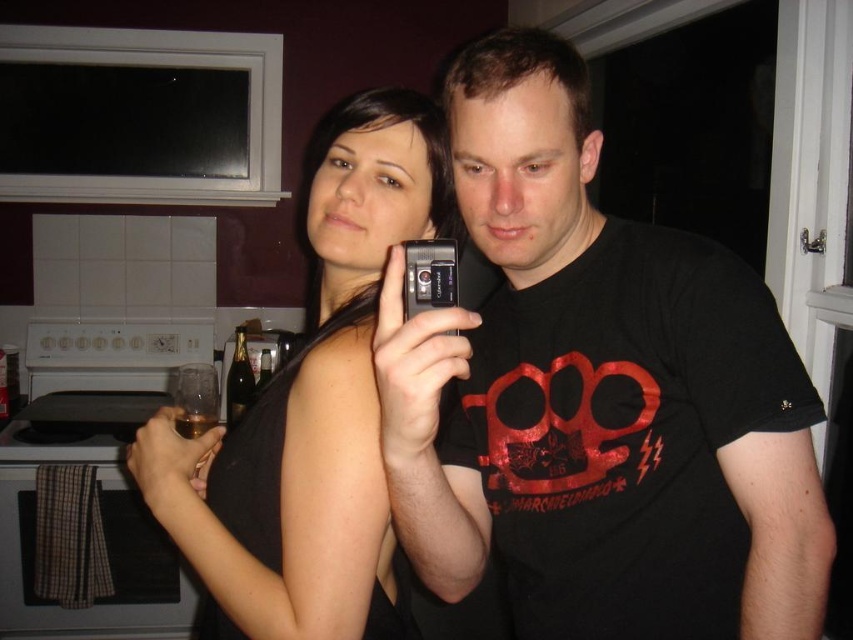
Is black matte tank top at center to the left of silver metallic camera at center from the viewer's perspective?

Indeed, black matte tank top at center is positioned on the left side of silver metallic camera at center.

Does black matte tank top at center have a smaller size compared to silver metallic camera at center?

No, black matte tank top at center is not smaller than silver metallic camera at center.

Between point (374, 294) and point (447, 252), which one is positioned behind?

Positioned behind is point (374, 294).

Identify the location of black matte tank top at center. (311, 406).

Is black matte tank top at center positioned behind shiny gold bottle at center?

No, black matte tank top at center is in front of shiny gold bottle at center.

The image size is (853, 640). What do you see at coordinates (311, 406) in the screenshot?
I see `black matte tank top at center` at bounding box center [311, 406].

Locate an element on the screen. black matte tank top at center is located at coordinates (311, 406).

Can you confirm if black matte t-shirt at center is bigger than black matte tank top at center?

Correct, black matte t-shirt at center is larger in size than black matte tank top at center.

Describe the element at coordinates (596, 396) in the screenshot. I see `black matte t-shirt at center` at that location.

Locate an element on the screen. black matte t-shirt at center is located at coordinates (596, 396).